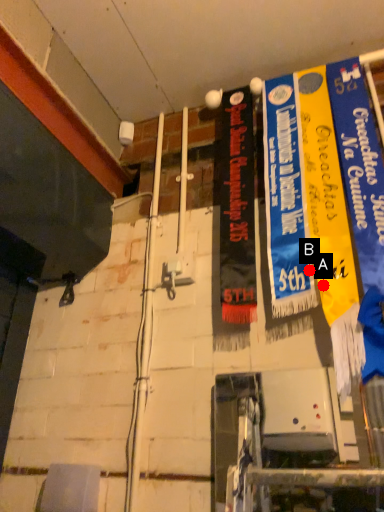
Question: Two points are circled on the image, labeled by A and B beside each circle. Which point is closer to the camera?

Choices:
 (A) A is closer
 (B) B is closer

Answer: (A)